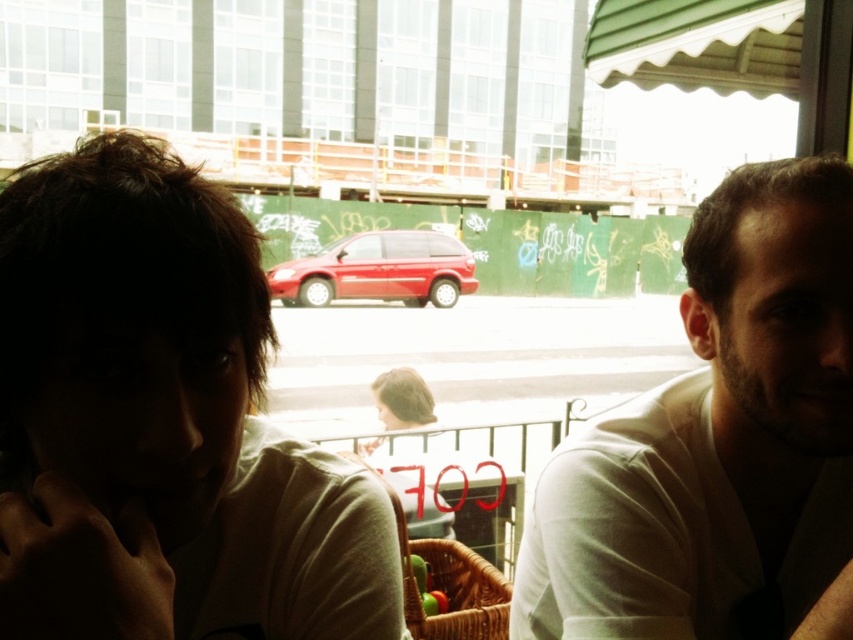
Does matte red van at center have a lesser height compared to blonde hair at center?

In fact, matte red van at center may be taller than blonde hair at center.

Can you confirm if matte red van at center is taller than blonde hair at center?

Yes, matte red van at center is taller than blonde hair at center.

Is point (440, 253) farther from viewer compared to point (383, 376)?

Yes, it is.

Where is `matte red van at center`? The width and height of the screenshot is (853, 640). matte red van at center is located at coordinates (378, 269).

Is white matte shirt at right to the right of matte red van at center from the viewer's perspective?

Yes, white matte shirt at right is to the right of matte red van at center.

Looking at this image, how much distance is there between white matte shirt at right and matte red van at center?

white matte shirt at right and matte red van at center are 14.93 meters apart from each other.

Identify the location of white matte shirt at right. (717, 440).

Between point (781, 513) and point (369, 449), which one is positioned behind?

The point (369, 449) is behind.

Does white matte shirt at right have a larger size compared to blonde hair at center?

Yes.

Does point (820, 372) come in front of point (402, 426)?

Yes, it is in front of point (402, 426).

The width and height of the screenshot is (853, 640). I want to click on white matte shirt at right, so click(x=717, y=440).